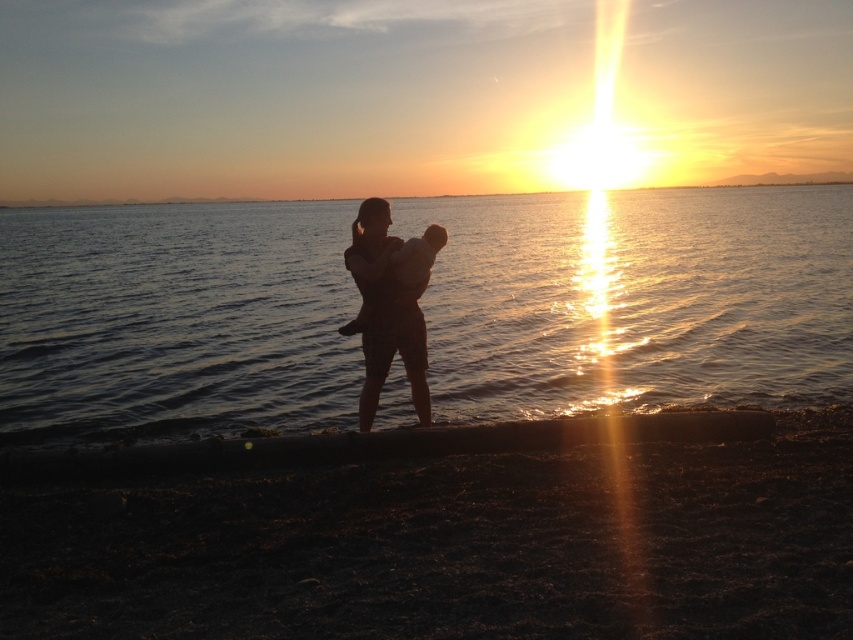
You are standing at the point closer to the sun in the sunset scene. There are two points marked in the image, one at coordinates point (653, 348) and the other at point (410, 305). Which point is farther away from you?

Point (653, 348) is behind point (410, 305), so if you are standing at the point closer to the sun, the farther point from you would be point (653, 348).

You are observing the sunset scene and notice two points in the image. The first point is at coordinates point (595, 541) and the second is at point (415, 332). Which of these points is closer to your viewpoint as you look at the scene?

Point (595, 541) is closer to the camera than point (415, 332), so the first point is closer to your viewpoint.

You are a photographer trying to capture the sunset scene. You notice the dark sand at lower center and the silhouette fabric at center in your viewfinder. Which object is located below the other?

The dark sand at lower center is positioned under the silhouette fabric at center, so the dark sand at lower center is below the silhouette fabric at center.